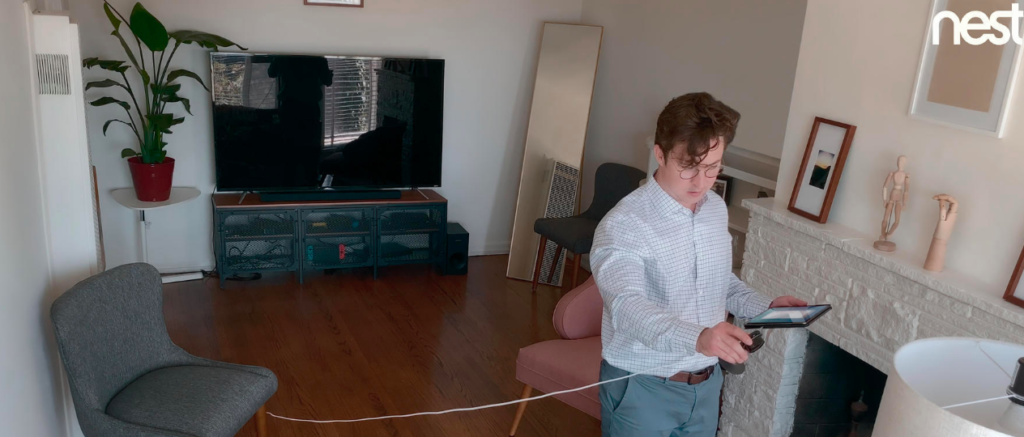
Find where i would check out my apperance in the image. Your answer should be formatted as a list of tuples, i.e. [(x1, y1), (x2, y2), ...], where each tuple contains the x and y coordinates of a point satisfying the conditions above.

[(555, 154)]